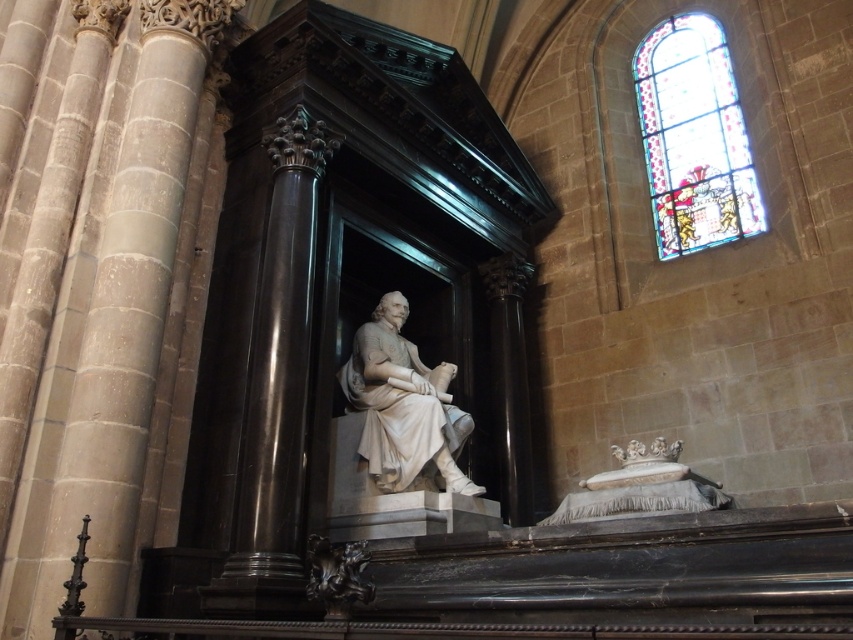
Describe the element at coordinates (693, 138) in the screenshot. I see `stained glass at upper right` at that location.

Find the location of `stained glass at upper right`. stained glass at upper right is located at coordinates (693, 138).

Locate an element on the screen. This screenshot has height=640, width=853. stained glass at upper right is located at coordinates (693, 138).

Does stained glass at upper right appear on the right side of white marble statue at center?

Yes, stained glass at upper right is to the right of white marble statue at center.

This screenshot has width=853, height=640. Describe the element at coordinates (693, 138) in the screenshot. I see `stained glass at upper right` at that location.

Is point (746, 209) positioned in front of point (413, 346)?

No, (746, 209) is behind (413, 346).

At what (x,y) coordinates should I click in order to perform the action: click on stained glass at upper right. Please return your answer as a coordinate pair (x, y). Looking at the image, I should click on (693, 138).

Does white marble statue at center lie behind polished dark wood carving at lower left?

Yes, white marble statue at center is further from the viewer.

Is white marble statue at center to the right of polished dark wood carving at lower left from the viewer's perspective?

Correct, you'll find white marble statue at center to the right of polished dark wood carving at lower left.

Find the location of a particular element. white marble statue at center is located at coordinates (403, 404).